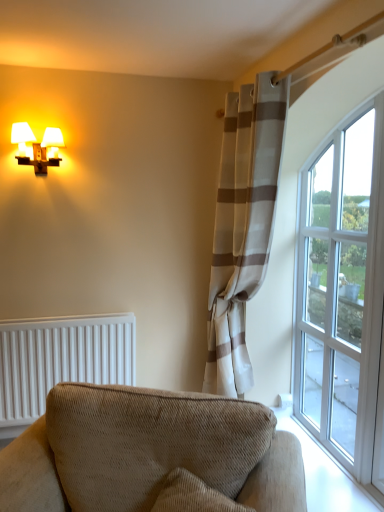
Question: Is matte white sconce at upper left positioned far away from beige corduroy couch at lower center?

Choices:
 (A) no
 (B) yes

Answer: (B)

Question: Does matte white sconce at upper left have a lesser width compared to beige corduroy couch at lower center?

Choices:
 (A) yes
 (B) no

Answer: (A)

Question: Considering the relative sizes of matte white sconce at upper left and beige corduroy couch at lower center in the image provided, is matte white sconce at upper left bigger than beige corduroy couch at lower center?

Choices:
 (A) no
 (B) yes

Answer: (A)

Question: From the image's perspective, is matte white sconce at upper left under beige corduroy couch at lower center?

Choices:
 (A) yes
 (B) no

Answer: (B)

Question: Is beige corduroy couch at lower center at the back of matte white sconce at upper left?

Choices:
 (A) no
 (B) yes

Answer: (A)

Question: Is matte white sconce at upper left smaller than beige corduroy couch at lower center?

Choices:
 (A) no
 (B) yes

Answer: (B)

Question: Does clear glass window at right come behind matte white sconce at upper left?

Choices:
 (A) no
 (B) yes

Answer: (A)

Question: Is clear glass window at right bigger than matte white sconce at upper left?

Choices:
 (A) no
 (B) yes

Answer: (B)

Question: From a real-world perspective, is clear glass window at right beneath matte white sconce at upper left?

Choices:
 (A) no
 (B) yes

Answer: (B)

Question: Is clear glass window at right facing towards matte white sconce at upper left?

Choices:
 (A) yes
 (B) no

Answer: (A)

Question: Are clear glass window at right and matte white sconce at upper left far apart?

Choices:
 (A) no
 (B) yes

Answer: (B)

Question: Is clear glass window at right to the left of matte white sconce at upper left from the viewer's perspective?

Choices:
 (A) no
 (B) yes

Answer: (A)

Question: From the image's perspective, does beige corduroy couch at lower center appear lower than clear glass window at right?

Choices:
 (A) yes
 (B) no

Answer: (A)